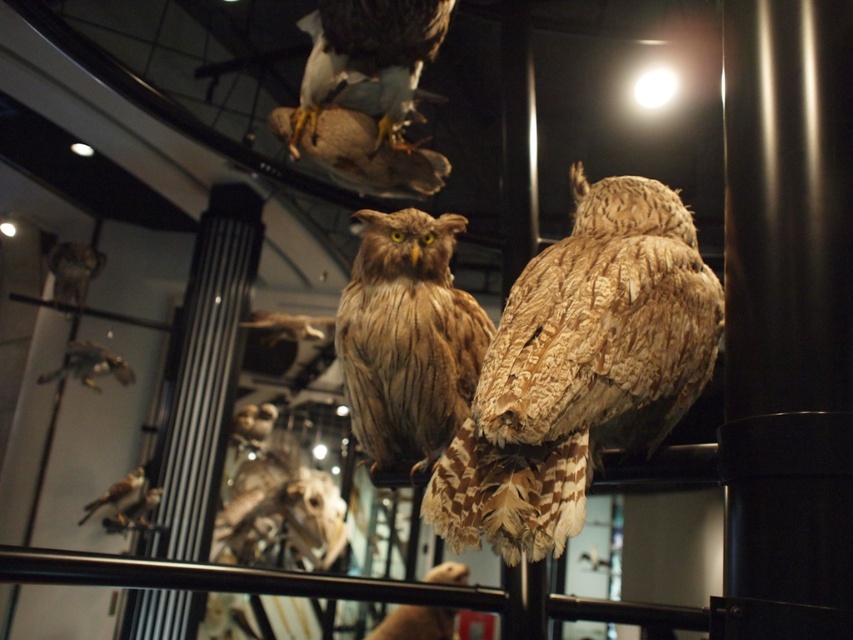
Question: Can you confirm if brown textured owl at center is positioned below brown feathered owl at lower left?

Choices:
 (A) yes
 (B) no

Answer: (B)

Question: Can you confirm if brown feathered owl at upper center is positioned to the left of brown speckled feathers at lower left?

Choices:
 (A) yes
 (B) no

Answer: (B)

Question: Does brown feathered owl at upper center have a greater width compared to brown speckled feathers at lower left?

Choices:
 (A) no
 (B) yes

Answer: (B)

Question: Which point is closer to the camera?

Choices:
 (A) brown feathered owl at lower left
 (B) brown speckled feathers at lower left

Answer: (B)

Question: Estimate the real-world distances between objects in this image. Which object is farther from the brown textured owl at center?

Choices:
 (A) brown speckled feathers at lower left
 (B) brown textured feathers at center
 (C) brown feathered owl at upper center

Answer: (A)

Question: Which of these objects is positioned closest to the brown feathered owl at upper center?

Choices:
 (A) brown textured feathers at center
 (B) brown feathered owl at lower left

Answer: (A)